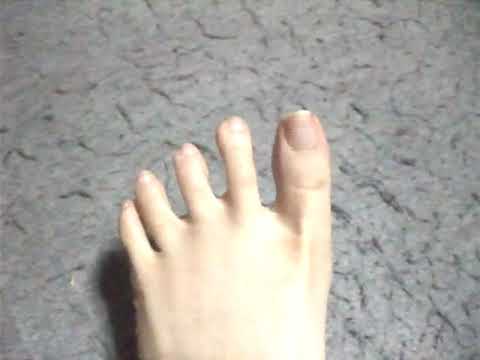
Locate an element on the screen. carpet is located at coordinates 420,218.